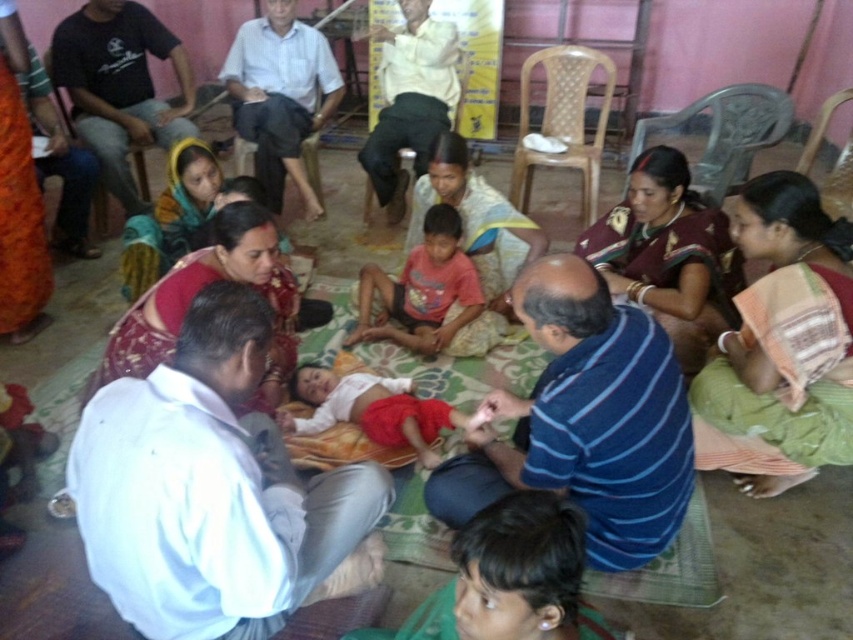
Question: Is white cotton shirt at center behind red cotton shirt at center?

Choices:
 (A) yes
 (B) no

Answer: (B)

Question: Which object appears closest to the camera in this image?

Choices:
 (A) white cotton shirt at center
 (B) light blue shirt at center
 (C) white cotton cloth at center

Answer: (A)

Question: Considering the real-world distances, which object is closest to the black cotton shirt at upper left?

Choices:
 (A) light blue shirt at center
 (B) white cotton shirt at center

Answer: (A)

Question: Is light blue shirt at center to the right of white cotton cloth at center from the viewer's perspective?

Choices:
 (A) yes
 (B) no

Answer: (B)

Question: Does blue striped shirt at center have a larger size compared to light yellow shirt at upper center?

Choices:
 (A) no
 (B) yes

Answer: (B)

Question: Which point is farther from the camera taking this photo?

Choices:
 (A) (189, 113)
 (B) (221, 538)
 (C) (387, 157)
 (D) (560, 269)

Answer: (A)